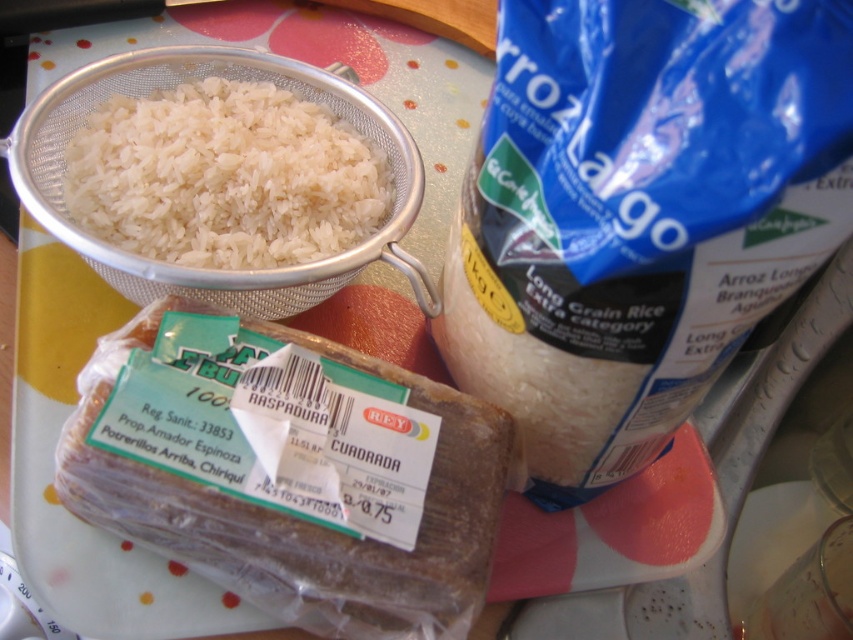
You are a chef preparing a meal and need to place the brown bread at center on the kitchen countertop. Where exactly should you put it?

The brown bread at center should be placed at point coordinates of (300, 518).

You are a chef arranging ingredients on a kitchen counter. You have a brown bread at center and a white matte rice at upper left. Which item is positioned closer to you?

The brown bread at center is closer to the viewer than the white matte rice at upper left.